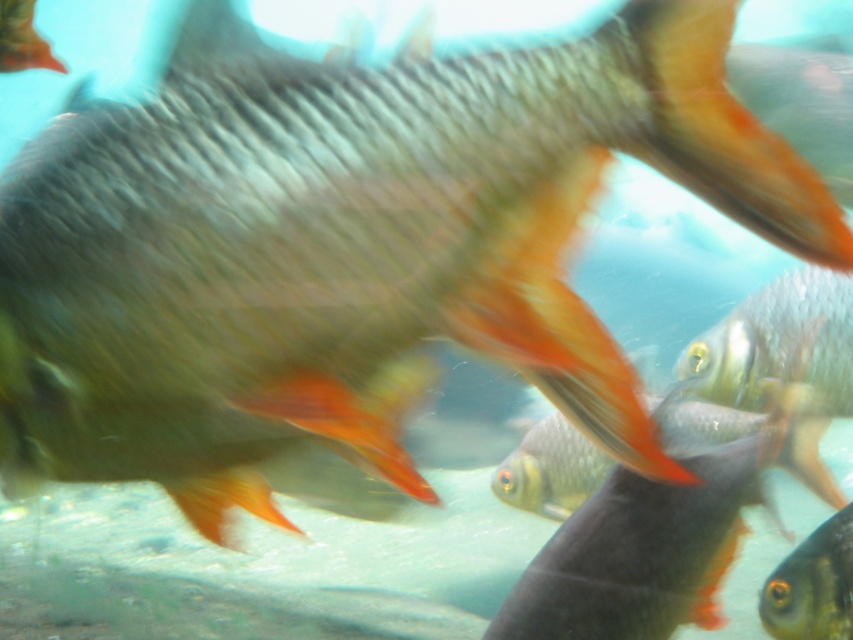
Is shiny silver fish at center positioned before matte orange fish at upper left?

That is True.

Can you confirm if shiny silver fish at center is shorter than matte orange fish at upper left?

No, shiny silver fish at center is not shorter than matte orange fish at upper left.

Which is behind, point (572, 630) or point (12, 13)?

Positioned behind is point (12, 13).

I want to click on shiny silver fish at center, so click(643, 550).